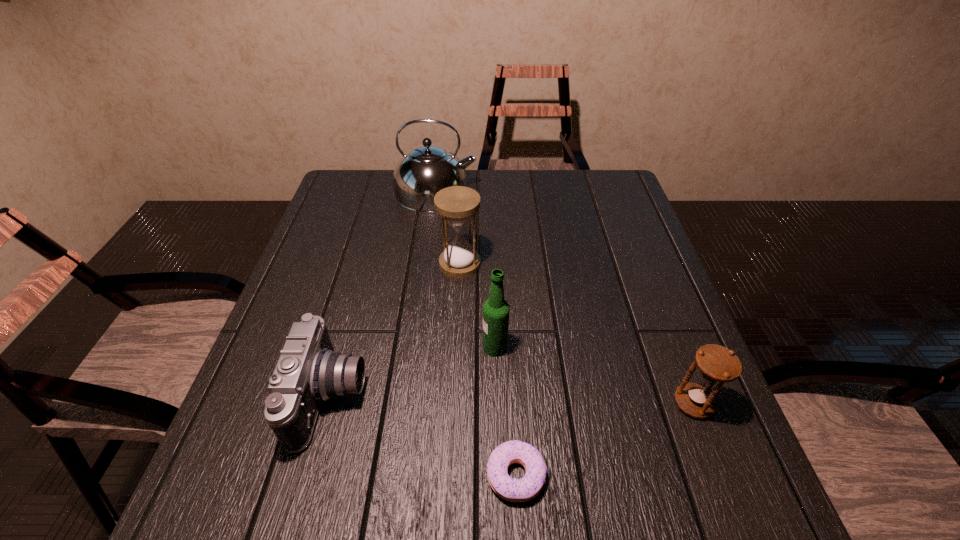
You are a GUI agent. You are given a task and a screenshot of the screen. Output one action in this format:
    pyautogui.click(x=<x>, y=<y>)
    Task: Click on the vacant area between the camera and the farther hourglass
    This screenshot has width=960, height=540.
    Given the screenshot: What is the action you would take?
    pyautogui.click(x=396, y=330)

Where is `vacant space that's between the rightmost object and the doughnut`? This screenshot has width=960, height=540. vacant space that's between the rightmost object and the doughnut is located at coordinates (605, 439).

You are a GUI agent. You are given a task and a screenshot of the screen. Output one action in this format:
    pyautogui.click(x=<x>, y=<y>)
    Task: Click on the unoccupied area between the farthest object and the farther hourglass
    Image resolution: width=960 pixels, height=540 pixels.
    Given the screenshot: What is the action you would take?
    pyautogui.click(x=447, y=227)

Locate an element on the screen. This screenshot has width=960, height=540. blank region between the taller hourglass and the camera is located at coordinates pos(396,330).

Find the location of a particular element. empty space that is in between the shortest object and the camera is located at coordinates (423, 436).

You are a GUI agent. You are given a task and a screenshot of the screen. Output one action in this format:
    pyautogui.click(x=<x>, y=<y>)
    Task: Click on the vacant area that lies between the shorter hourglass and the beer bottle
    The image size is (960, 540).
    Given the screenshot: What is the action you would take?
    pyautogui.click(x=594, y=375)

The height and width of the screenshot is (540, 960). I want to click on vacant space in between the right hourglass and the kettle, so click(564, 297).

Identify the location of object that can be found as the second closest to the farthest object. This screenshot has width=960, height=540. (496, 309).

Locate an element on the screen. Image resolution: width=960 pixels, height=540 pixels. object that stands as the fourth closest to the right hourglass is located at coordinates (308, 372).

The width and height of the screenshot is (960, 540). What are the coordinates of `free space that satisfies the following two spatial constraints: 1. on the front-facing side of the camera; 2. on the left side of the shortest object` in the screenshot? It's located at (311, 475).